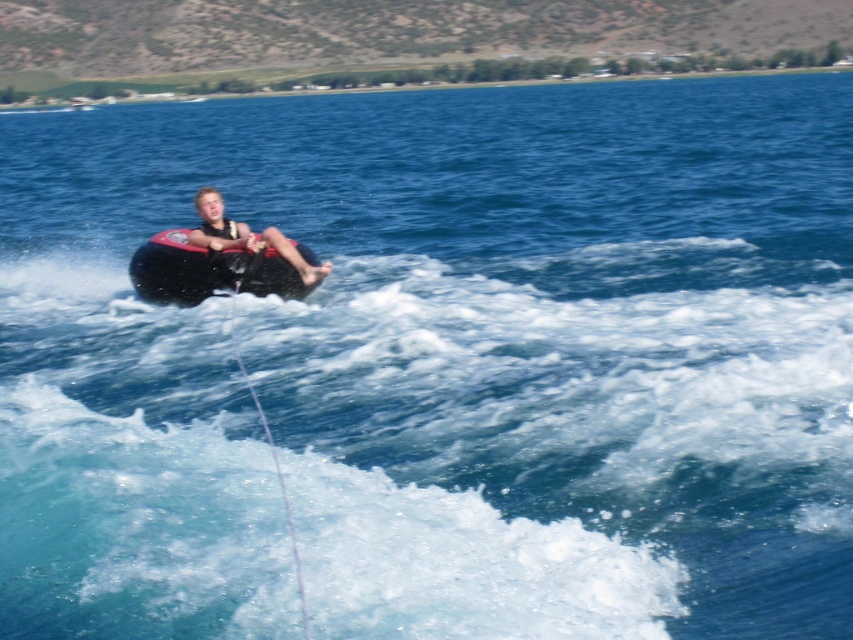
You are a safety inspector checking the water tubing equipment. You notice two tubes, the black rubber tube at center and the matte black tube at center. Which one is bigger?

The black rubber tube at center is larger in size compared to the matte black tube at center.

You are a safety inspector checking the water tubing setup. You see the black rubber tube at center and the white string at center. Based on their sizes, which object is more likely to be the tow rope used to pull the tube?

The black rubber tube at center is wider than the white string at center, so the white string at center is more likely to be the tow rope used to pull the tube since tow ropes are typically thinner and more flexible than the tube itself.

You are standing at the camera position and want to throw a lifebuoy to the person in the matte black tube at center. The lifebuoy can travel 15 meters. Do you think it will reach them?

The matte black tube at center and camera are 14.49 meters apart from each other. Since the lifebuoy can travel 15 meters, it will reach the person in the matte black tube at center.